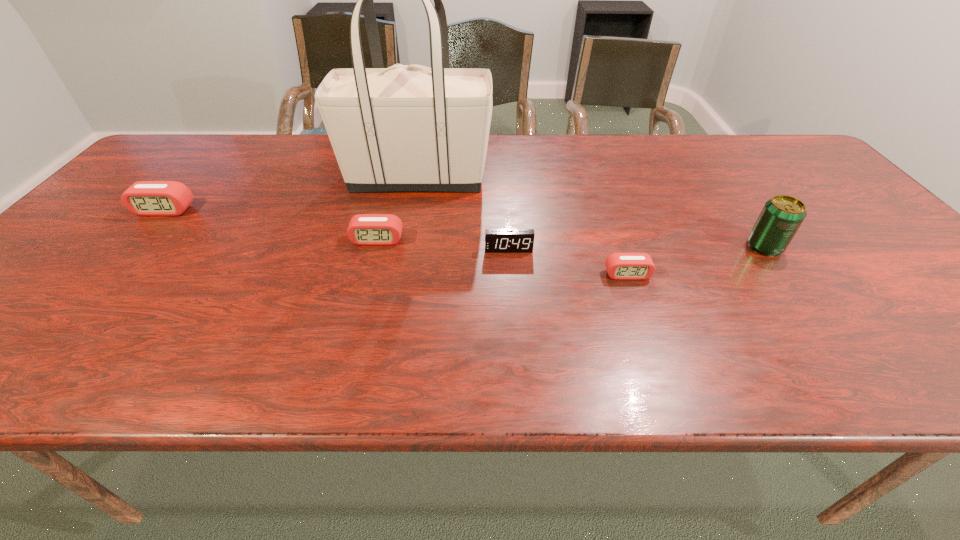
Find the location of a particular element. This screenshot has height=540, width=960. free space at the right edge is located at coordinates (820, 226).

In order to click on vacant space at the far right corner of the desktop in this screenshot , I will do `click(778, 139)`.

Locate an element on the screen. Image resolution: width=960 pixels, height=540 pixels. free area in between the third tallest object and the second alarm clock from left to right is located at coordinates (271, 225).

Locate an element on the screen. This screenshot has width=960, height=540. free space between the shopping bag and the second alarm clock from right to left is located at coordinates (463, 213).

Locate an element on the screen. The image size is (960, 540). empty space that is in between the tallest object and the nearest alarm clock is located at coordinates coord(522,226).

Locate an element on the screen. free space that is in between the third alarm clock from left to right and the tallest object is located at coordinates (463, 213).

This screenshot has height=540, width=960. In order to click on free spot between the tallest object and the third alarm clock from left to right in this screenshot , I will do `click(463, 213)`.

You are a GUI agent. You are given a task and a screenshot of the screen. Output one action in this format:
    pyautogui.click(x=<x>, y=<y>)
    Task: Click on the vacant space that's between the third alarm clock from left to right and the nearest object
    The height and width of the screenshot is (540, 960).
    Given the screenshot: What is the action you would take?
    pyautogui.click(x=568, y=262)

Locate an element on the screen. This screenshot has height=540, width=960. empty space that is in between the third alarm clock from left to right and the nearest object is located at coordinates (568, 262).

Identify the location of unoccupied area between the third alarm clock from left to right and the nearest alarm clock. (568, 262).